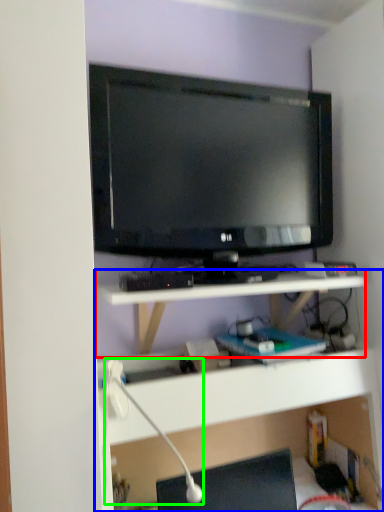
Question: Which is farther away from shelf (highlighted by a red box)? shelf (highlighted by a blue box) or lamp (highlighted by a green box)?

Choices:
 (A) shelf
 (B) lamp

Answer: (B)